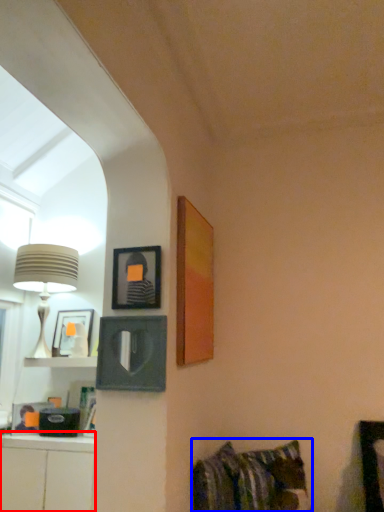
Question: Which object is further to the camera taking this photo, cabinetry (highlighted by a red box) or bed (highlighted by a blue box)?

Choices:
 (A) cabinetry
 (B) bed

Answer: (B)